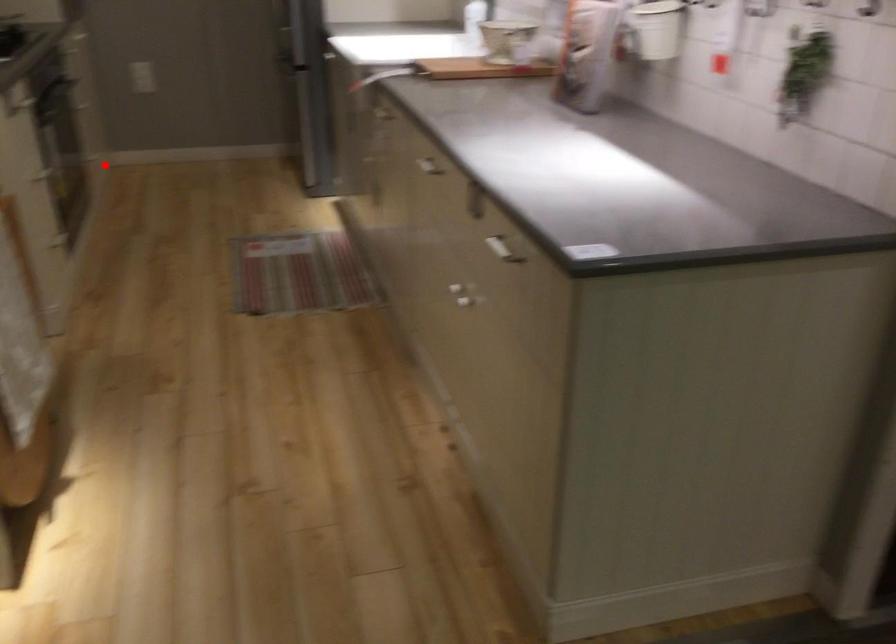
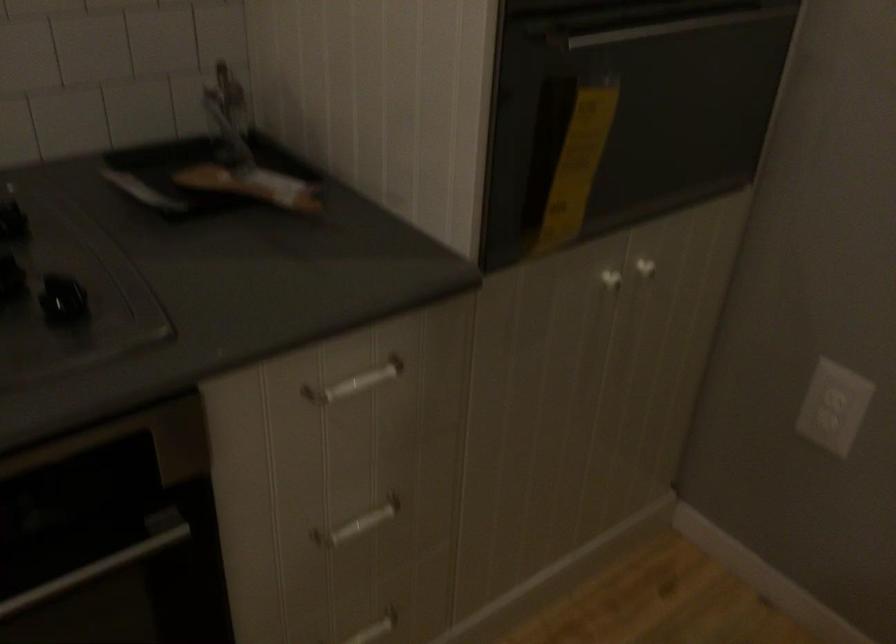
Question: A red point is marked in image1. In image2, is the corresponding 3D point closer to the camera or farther? Reply with the corresponding letter.

Choices:
 (A) The corresponding 3D point is closer.
 (B) The corresponding 3D point is farther.

Answer: (A)